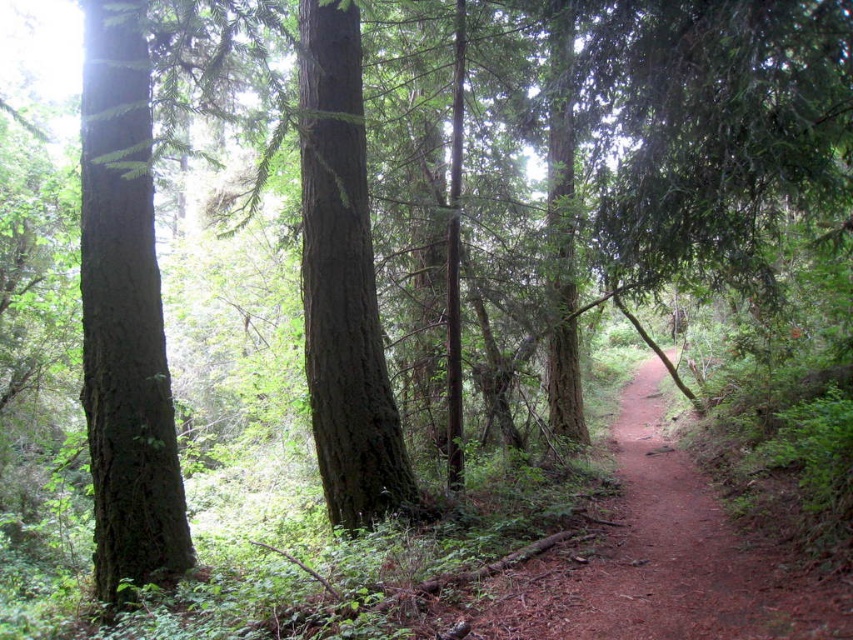
Can you confirm if dirt path at center is bigger than smooth brown tree trunk at center?

Correct, dirt path at center is larger in size than smooth brown tree trunk at center.

Who is shorter, dirt path at center or smooth brown tree trunk at center?

dirt path at center is shorter.

Between point (752, 612) and point (352, 61), which one is positioned behind?

The point (352, 61) is behind.

Where is `dirt path at center`? This screenshot has height=640, width=853. dirt path at center is located at coordinates (683, 552).

Is point (138, 403) in front of point (793, 611)?

No, (138, 403) is further to viewer.

Between point (157, 401) and point (643, 595), which one is positioned in front?

Point (643, 595)

This screenshot has height=640, width=853. Find the location of `green rough bark tree at left`. green rough bark tree at left is located at coordinates (125, 317).

Is point (107, 58) in front of point (329, 116)?

No, (107, 58) is further to viewer.

Does point (144, 237) lie behind point (387, 461)?

No, it is not.

Find the location of a particular element. The width and height of the screenshot is (853, 640). green rough bark tree at left is located at coordinates (125, 317).